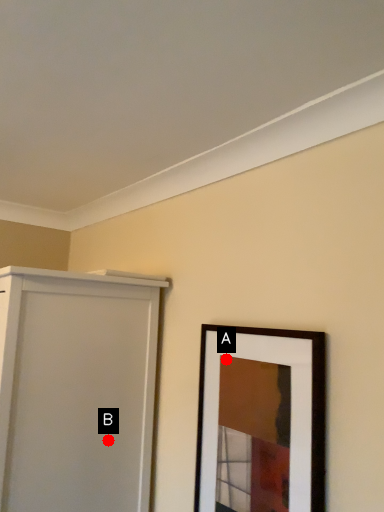
Question: Two points are circled on the image, labeled by A and B beside each circle. Which point is farther to the camera?

Choices:
 (A) A is further
 (B) B is further

Answer: (B)